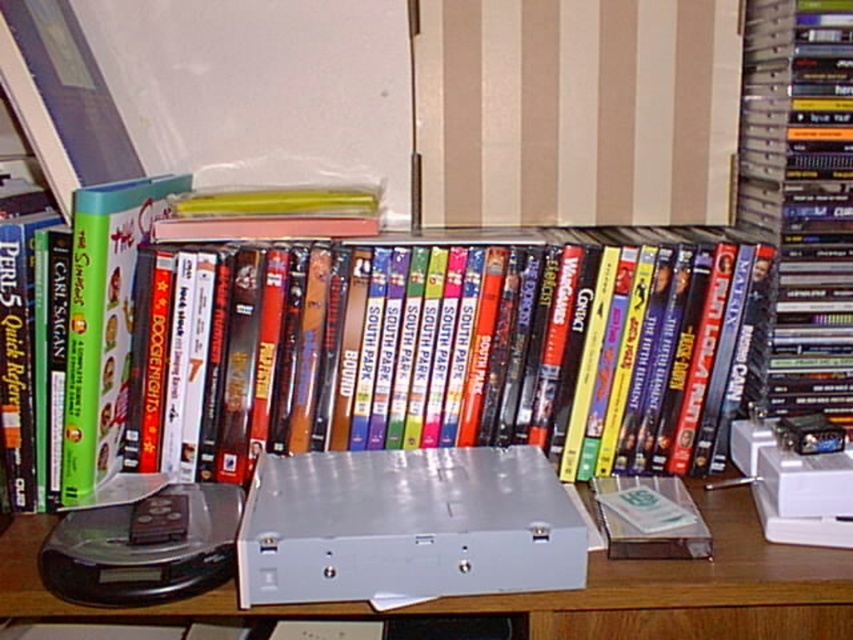
Looking at this image, you are organizing a library and need to place two hardcover books on a shelf. The hardcover book at center and the hardcover book at right. Which book requires more shelf space due to its size?

The hardcover book at center requires more shelf space because it is larger in size compared to the hardcover book at right.

You are standing in front of a shelf with DVDs and books. There are two points marked on the shelf. The first point is at position (242, 292) and the second point is at (799, 355). If you were to walk towards the shelf, which point would you encounter first?

Point (242, 292) is in front of point (799, 355), so you would encounter point (242, 292) first as you walk towards the shelf.